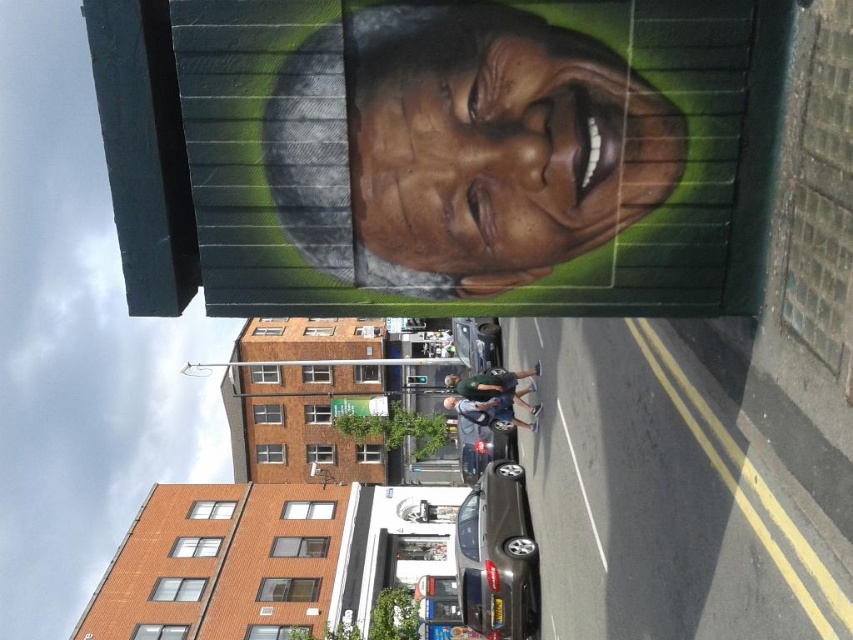
Question: Can you confirm if smooth paint portrait at upper center is positioned below green fabric shirt at center?

Choices:
 (A) yes
 (B) no

Answer: (B)

Question: Does metallic gray sedan at center have a greater width compared to matte black jacket at center?

Choices:
 (A) no
 (B) yes

Answer: (A)

Question: Which object is the closest to the metallic gray sedan at center?

Choices:
 (A) shiny silver car at center
 (B) smooth paint portrait at upper center

Answer: (A)

Question: Which point is closer to the camera?

Choices:
 (A) matte black jacket at center
 (B) smooth paint portrait at upper center
 (C) green fabric shirt at center

Answer: (B)

Question: Estimate the real-world distances between objects in this image. Which object is farther from the matte brown face at upper center?

Choices:
 (A) green fabric shirt at center
 (B) smooth paint portrait at upper center

Answer: (A)

Question: Is shiny silver car at center further to the viewer compared to green fabric shirt at center?

Choices:
 (A) yes
 (B) no

Answer: (A)